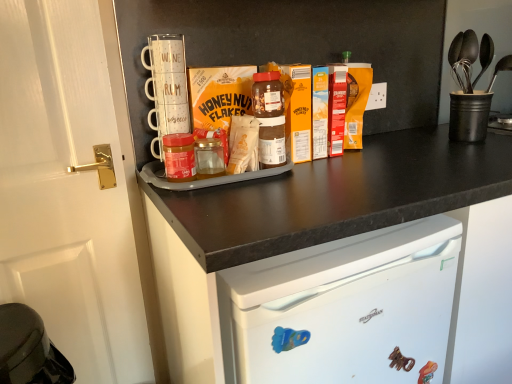
Question: Can you confirm if black matte cup at upper right is smaller than matte glass jar at center?

Choices:
 (A) yes
 (B) no

Answer: (B)

Question: From the image's perspective, would you say black matte cup at upper right is shown under matte glass jar at center?

Choices:
 (A) no
 (B) yes

Answer: (A)

Question: Is black matte cup at upper right facing towards matte glass jar at center?

Choices:
 (A) yes
 (B) no

Answer: (B)

Question: From a real-world perspective, is black matte cup at upper right on matte glass jar at center?

Choices:
 (A) yes
 (B) no

Answer: (A)

Question: Considering the relative sizes of black matte cup at upper right and matte glass jar at center in the image provided, is black matte cup at upper right thinner than matte glass jar at center?

Choices:
 (A) no
 (B) yes

Answer: (A)

Question: From a real-world perspective, is matte cardboard honey nut flakes at center above or below black matte cabinet at center?

Choices:
 (A) below
 (B) above

Answer: (B)

Question: Based on their positions, is matte cardboard honey nut flakes at center located to the left or right of black matte cabinet at center?

Choices:
 (A) left
 (B) right

Answer: (A)

Question: Is matte cardboard honey nut flakes at center wider or thinner than black matte cabinet at center?

Choices:
 (A) thin
 (B) wide

Answer: (A)

Question: In the image, is matte cardboard honey nut flakes at center positioned in front of or behind black matte cabinet at center?

Choices:
 (A) behind
 (B) front

Answer: (A)

Question: Considering the positions of black matte cabinet at center and matte cardboard honey nut flakes at center in the image, is black matte cabinet at center taller or shorter than matte cardboard honey nut flakes at center?

Choices:
 (A) tall
 (B) short

Answer: (A)

Question: Is black matte cabinet at center inside the boundaries of matte cardboard honey nut flakes at center, or outside?

Choices:
 (A) inside
 (B) outside

Answer: (B)

Question: Is black matte cabinet at center wider or thinner than matte cardboard honey nut flakes at center?

Choices:
 (A) thin
 (B) wide

Answer: (B)

Question: Is point (390, 165) closer or farther from the camera than point (243, 148)?

Choices:
 (A) closer
 (B) farther

Answer: (B)

Question: From a real-world perspective, relative to matte glass jar at center, is matte cardboard honey nut flakes at center vertically above or below?

Choices:
 (A) below
 (B) above

Answer: (B)

Question: Considering the positions of matte cardboard honey nut flakes at center and matte glass jar at center in the image, is matte cardboard honey nut flakes at center taller or shorter than matte glass jar at center?

Choices:
 (A) tall
 (B) short

Answer: (A)